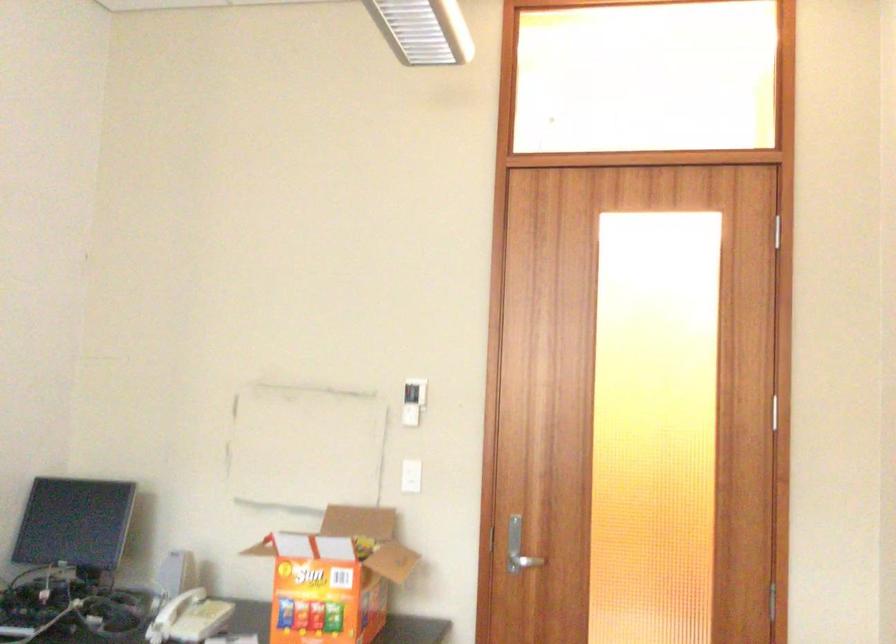
Where would you turn the silver door handle? Please return your answer as a coordinate pair (x, y).

(523, 562)